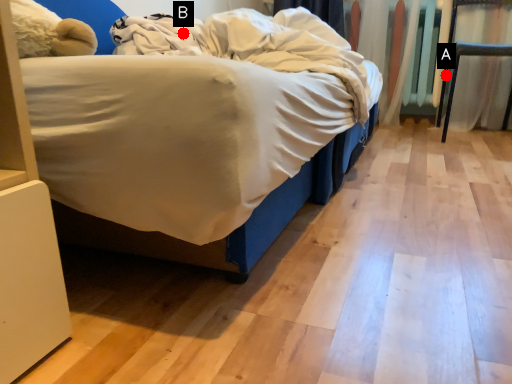
Question: Two points are circled on the image, labeled by A and B beside each circle. Which point appears closest to the camera in this image?

Choices:
 (A) A is closer
 (B) B is closer

Answer: (B)